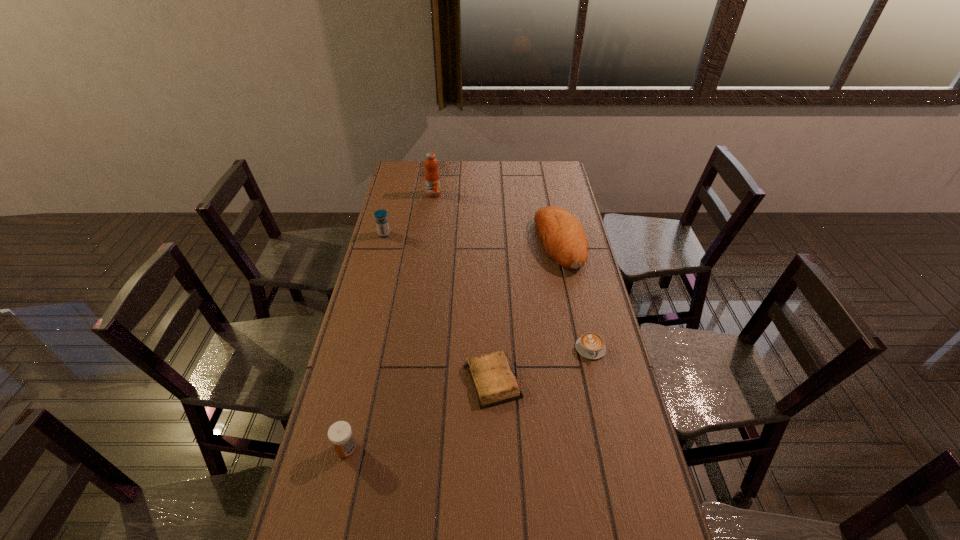
Identify the location of the fourth object from right to left. The height and width of the screenshot is (540, 960). (432, 180).

Identify the location of fruit juice. (432, 180).

At what (x,y) coordinates should I click in order to perform the action: click on the farther medicine. Please return your answer as a coordinate pair (x, y). This screenshot has height=540, width=960. Looking at the image, I should click on (382, 223).

Where is `bread`? Image resolution: width=960 pixels, height=540 pixels. bread is located at coordinates (563, 239).

You are a GUI agent. You are given a task and a screenshot of the screen. Output one action in this format:
    pyautogui.click(x=<x>, y=<y>)
    Task: Click on the nearer medicine
    The height and width of the screenshot is (540, 960).
    Given the screenshot: What is the action you would take?
    pyautogui.click(x=340, y=434)

Locate an element on the screen. the shorter medicine is located at coordinates (340, 434).

You are a GUI agent. You are given a task and a screenshot of the screen. Output one action in this format:
    pyautogui.click(x=<x>, y=<y>)
    Task: Click on the cappuccino
    Image resolution: width=960 pixels, height=540 pixels.
    Given the screenshot: What is the action you would take?
    pyautogui.click(x=590, y=345)

Locate an element on the screen. This screenshot has height=540, width=960. the fourth object from left to right is located at coordinates (492, 377).

Where is `vacant point located 0.380m on the front label of the fourth object from right to left`? The image size is (960, 540). vacant point located 0.380m on the front label of the fourth object from right to left is located at coordinates coord(426,249).

You are a GUI agent. You are given a task and a screenshot of the screen. Output one action in this format:
    pyautogui.click(x=<x>, y=<y>)
    Task: Click on the vacant region located on the front of the farther medicine
    
    Given the screenshot: What is the action you would take?
    pyautogui.click(x=369, y=294)